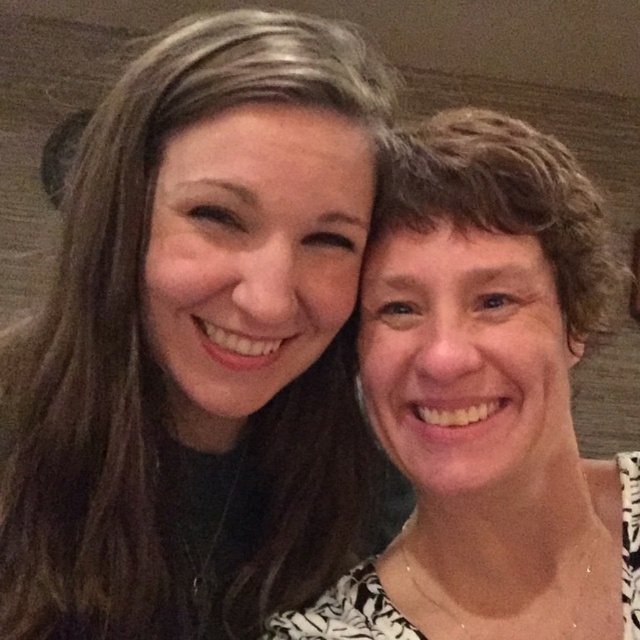
Is smooth brown hair at upper left taller than matte black hair at right?

Correct, smooth brown hair at upper left is much taller as matte black hair at right.

Which is more to the left, smooth brown hair at upper left or matte black hair at right?

Positioned to the left is smooth brown hair at upper left.

Find the location of a particular element. smooth brown hair at upper left is located at coordinates (196, 342).

Find the location of a particular element. smooth brown hair at upper left is located at coordinates (196, 342).